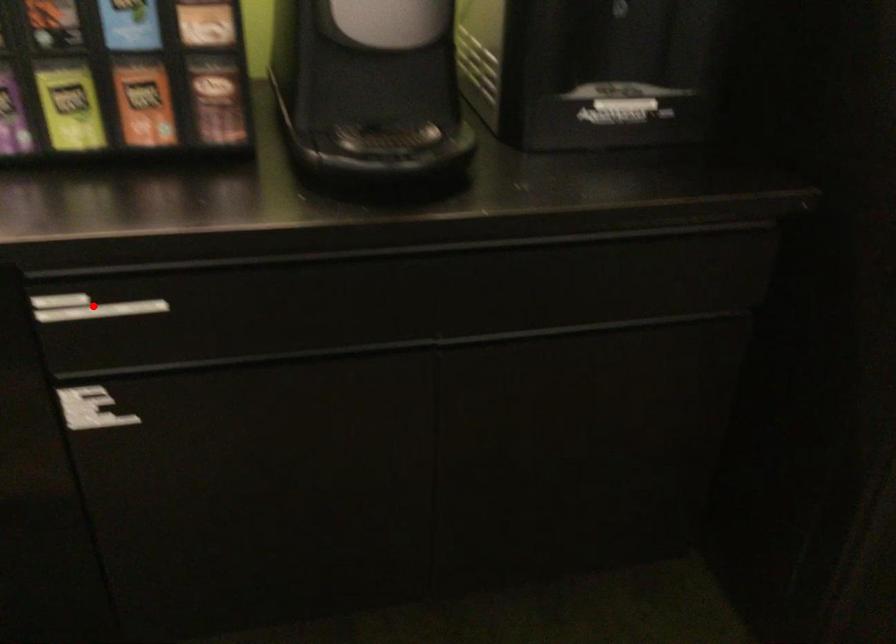
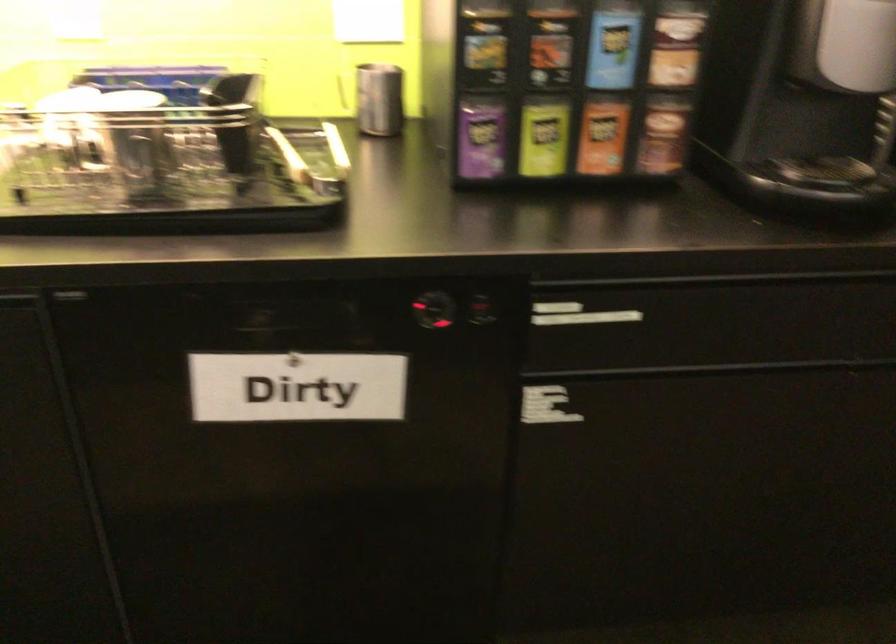
In the second image, find the point that corresponds to the highlighted location in the first image.

(578, 315)